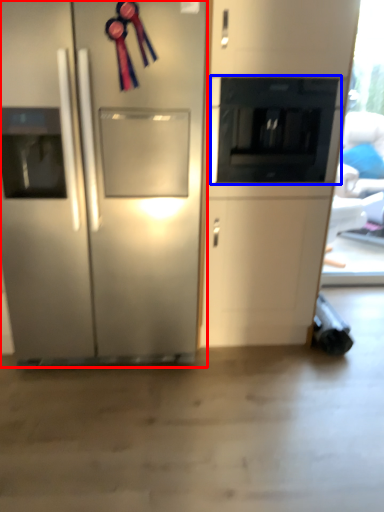
Question: Which of the following is the farthest to the observer, refrigerator (highlighted by a red box) or appliance (highlighted by a blue box)?

Choices:
 (A) refrigerator
 (B) appliance

Answer: (B)